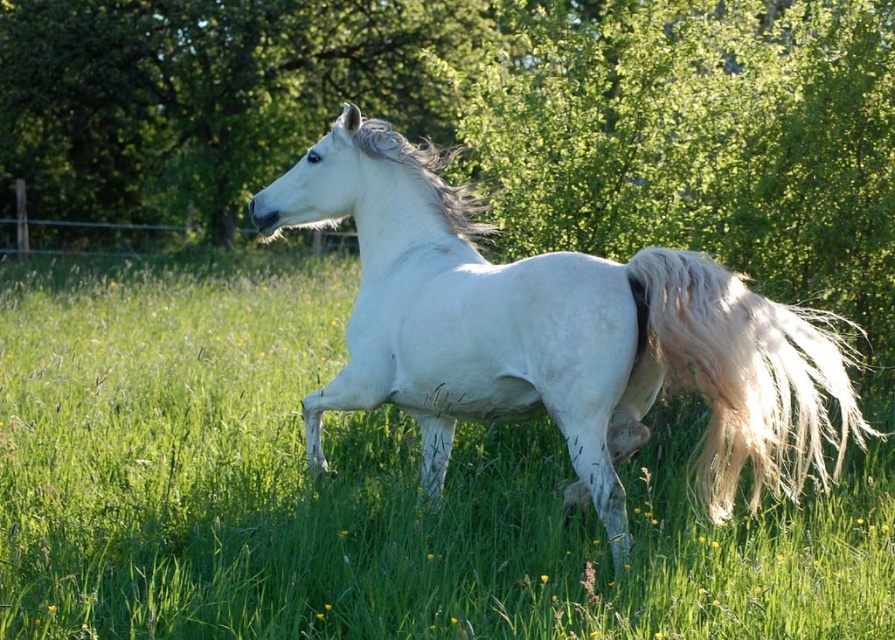
Can you confirm if white glossy horse at center is wider than white silky mane at center?

Correct, the width of white glossy horse at center exceeds that of white silky mane at center.

Is white glossy horse at center in front of white silky mane at center?

Yes, white glossy horse at center is closer to the viewer.

I want to click on white glossy horse at center, so click(556, 333).

Does point (527, 369) lie in front of point (675, 371)?

No, it is behind (675, 371).

Is point (459, 278) more distant than point (780, 390)?

Yes, point (459, 278) is farther from viewer.

Identify the location of white glossy horse at center. (556, 333).

Who is lower down, green leafy tree at center or white silky tail at right?

white silky tail at right

Looking at this image, does green leafy tree at center lie behind white silky tail at right?

Yes.

Which is in front, point (398, 4) or point (657, 298)?

Positioned in front is point (657, 298).

Where is `green leafy tree at center`? This screenshot has width=895, height=640. green leafy tree at center is located at coordinates (489, 120).